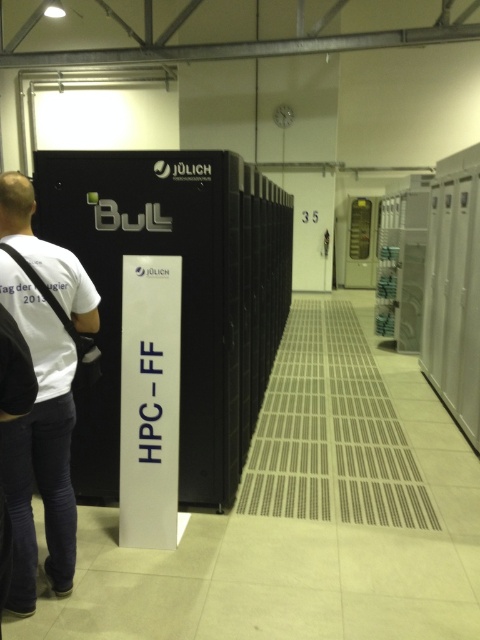
You are standing in front of the black metal server at center in a data center. If your height is 5 feet 10 inches, can you comfortably reach the top of the server without any assistance?

The black metal server at center is 9.30 feet away from the viewer. However, the height of the server is not provided in the description, so it is impossible to determine if you can reach the top without assistance.